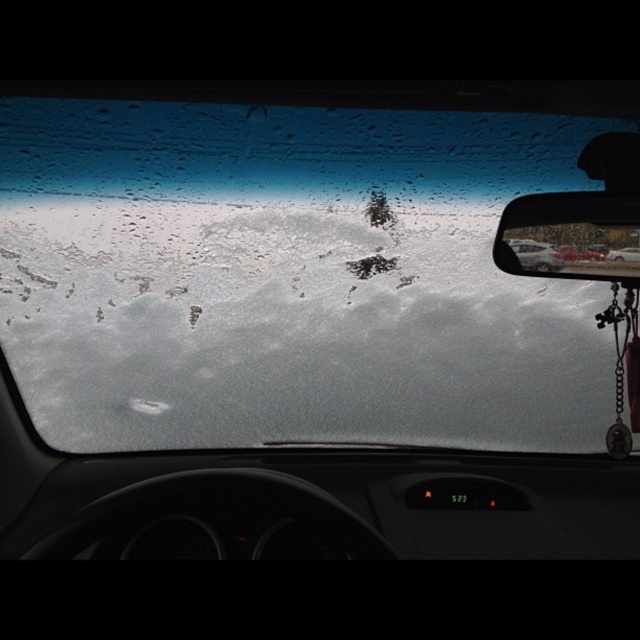
Looking at this image, you are driving in a snowstorm and need to check the time on the dashboard. The frosted glass windshield at center and the shiny plastic rearview mirror at upper right are both in your line of sight. Which object will you look at first to see the time?

The frosted glass windshield at center has a larger size compared to the shiny plastic rearview mirror at upper right, so you will look at the frosted glass windshield at center first because larger objects are more likely to catch your attention.

You are a delivery driver who needs to check the road conditions outside your car. The camera is mounted on the car to capture the view. Can you see the road clearly through the frosted glass windshield at center using the camera?

The frosted glass windshield at center and camera are 2.35 meters apart. However, the windshield is heavily frosted, which obscures the view, so the camera cannot see the road clearly through the frosted glass windshield at center.

You are driving in a snowstorm and need to check your surroundings. You notice the frosted glass windshield at center and the shiny plastic rearview mirror at upper right. Which object would provide a clearer view of the road ahead?

The shiny plastic rearview mirror at upper right would provide a clearer view because it is smaller and less frosted than the frosted glass windshield at center.